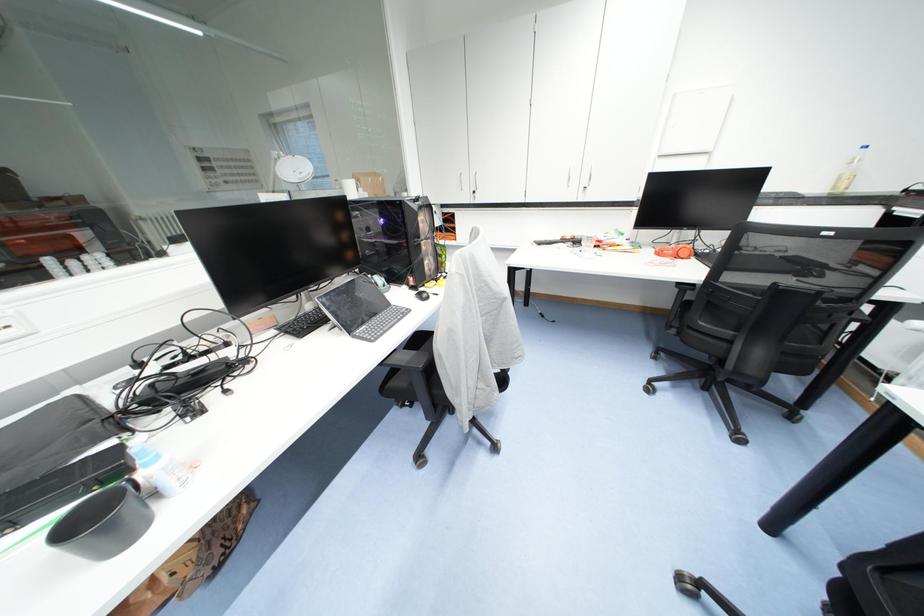
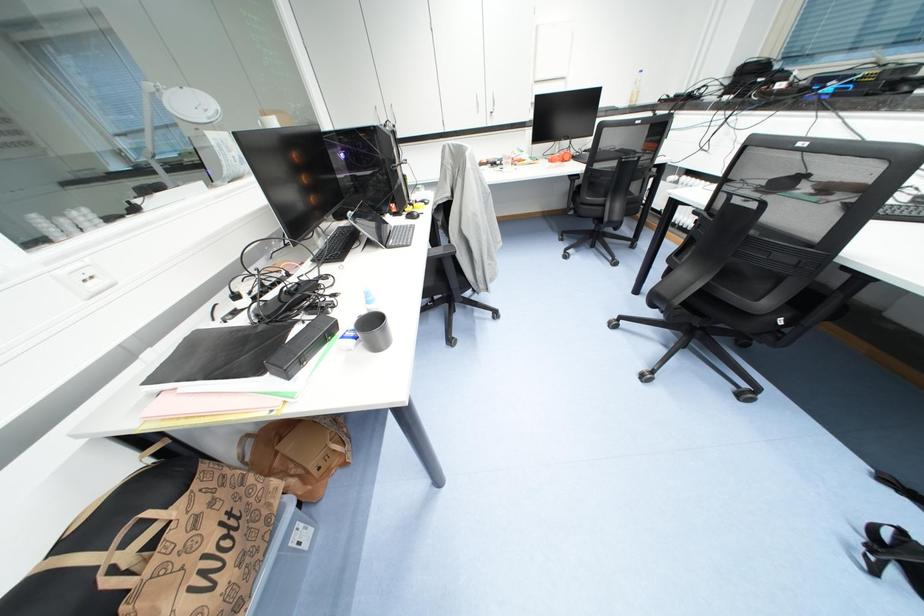
Question: The camera is either moving clockwise (left) or counter-clockwise (right) around the object. The first image is from the beginning of the video and the second image is from the end. Is the camera moving left or right when shooting the video?

Choices:
 (A) Left
 (B) Right

Answer: (A)